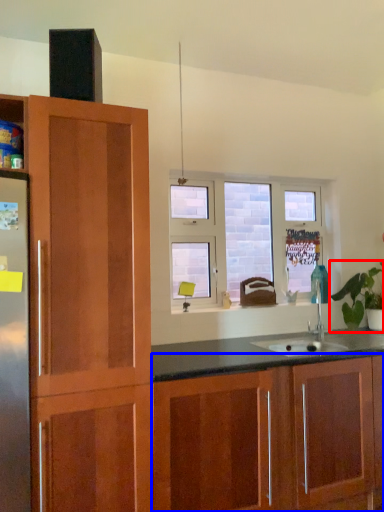
Question: Which point is further to the camera, houseplant (highlighted by a red box) or cabinetry (highlighted by a blue box)?

Choices:
 (A) houseplant
 (B) cabinetry

Answer: (A)